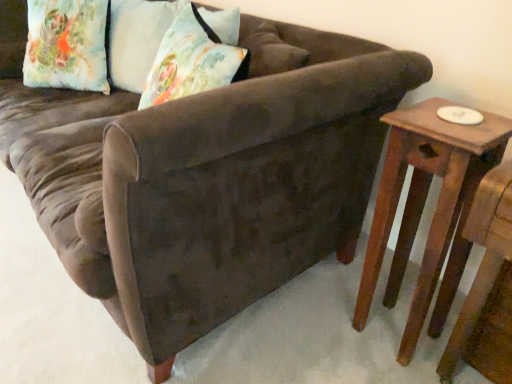
Locate an element on the screen. This screenshot has height=384, width=512. free space to the back side of wooden side table at right is located at coordinates (356, 280).